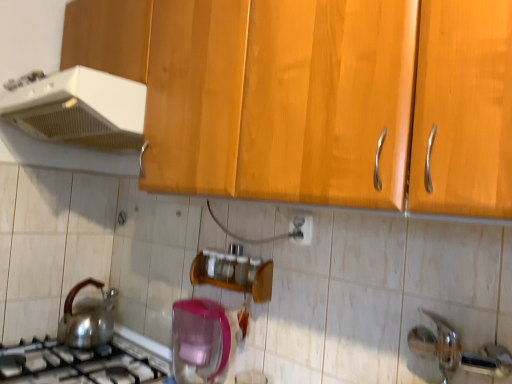
Question: Considering the positions of white glossy electric outlet at center and wooden spice rack at center in the image, is white glossy electric outlet at center wider or thinner than wooden spice rack at center?

Choices:
 (A) thin
 (B) wide

Answer: (A)

Question: From a real-world perspective, is white glossy electric outlet at center above or below wooden spice rack at center?

Choices:
 (A) above
 (B) below

Answer: (A)

Question: Considering the real-world distances, which object is farthest from the wooden spice rack at center?

Choices:
 (A) white glossy electric outlet at center
 (B) white plastic range hood at upper left, which is counted as the 3th kitchen appliance, starting from the bottom
 (C) translucent plastic container at lower center, the third kitchen appliance viewed from the top
 (D) shiny metallic kettle at lower left, placed as the 2th kitchen appliance when sorted from bottom to top
 (E) satin silver gas stove at lower left

Answer: (B)

Question: Estimate the real-world distances between objects in this image. Which object is closer to the shiny metallic kettle at lower left, placed as the 2th kitchen appliance when sorted from bottom to top?

Choices:
 (A) satin silver gas stove at lower left
 (B) translucent plastic container at lower center, the third kitchen appliance viewed from the top
 (C) wooden spice rack at center
 (D) white plastic range hood at upper left, arranged as the first kitchen appliance when viewed from the top
 (E) white glossy electric outlet at center

Answer: (A)